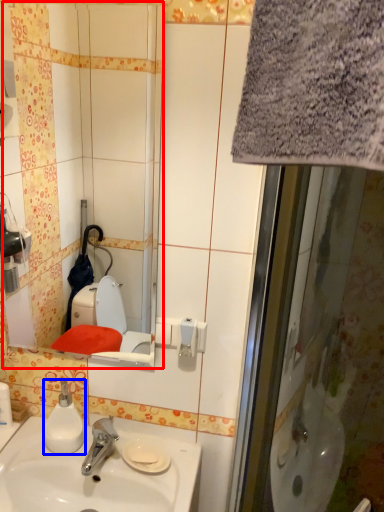
Question: Which of the following is the farthest to the observer, mirror (highlighted by a red box) or soap dispenser (highlighted by a blue box)?

Choices:
 (A) mirror
 (B) soap dispenser

Answer: (B)